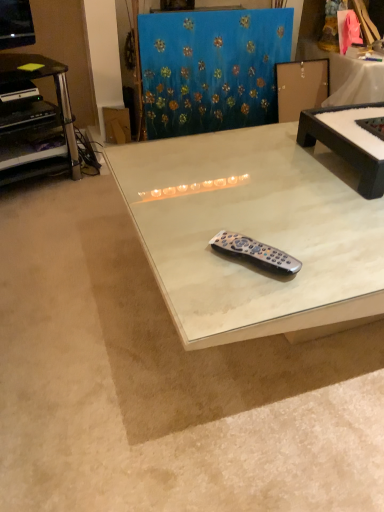
You are a GUI agent. You are given a task and a screenshot of the screen. Output one action in this format:
    pyautogui.click(x=<x>, y=<y>)
    Task: Click on the white marble table at center, the second table from the right
    This screenshot has width=384, height=512.
    Given the screenshot: What is the action you would take?
    pyautogui.click(x=253, y=233)

What do you see at coordinates (116, 125) in the screenshot? I see `cardboard at upper left` at bounding box center [116, 125].

Locate an element on the screen. The width and height of the screenshot is (384, 512). cardboard at upper left is located at coordinates (116, 125).

Measure the distance between point (x=343, y=112) and camera.

Point (x=343, y=112) is 4.36 feet from camera.

The height and width of the screenshot is (512, 384). Identify the location of white marble table at center, the second table from the right. (253, 233).

Is black plastic desk at left oriented towards cardboard at upper left?

No, black plastic desk at left is not turned towards cardboard at upper left.

From a real-world perspective, is black plastic desk at left under cardboard at upper left?

No, from a real-world perspective, black plastic desk at left is not beneath cardboard at upper left.

How many degrees apart are the facing directions of black plastic desk at left and cardboard at upper left?

The angular difference between black plastic desk at left and cardboard at upper left is 23.7 degrees.

Does black plastic desk at left touch cardboard at upper left?

There is a gap between black plastic desk at left and cardboard at upper left.

Between black plastic remote at center and white marble table at center, the second table from the right, which one has less height?

Standing shorter between the two is black plastic remote at center.

In terms of width, does black plastic remote at center look wider or thinner when compared to white marble table at center, the second table from the right?

Considering their sizes, black plastic remote at center looks slimmer than white marble table at center, the second table from the right.

Which is more to the left, black plastic remote at center or white marble table at center, the second table from the right?

black plastic remote at center is more to the left.

Is black plastic remote at center bigger or smaller than blue textured fabric at upper center?

Clearly, black plastic remote at center is smaller in size than blue textured fabric at upper center.

Is black plastic remote at center touching blue textured fabric at upper center?

black plastic remote at center and blue textured fabric at upper center are not in contact.

From a real-world perspective, is black plastic remote at center below blue textured fabric at upper center?

No, from a real-world perspective, black plastic remote at center is not below blue textured fabric at upper center.

Could you tell me if black plastic remote at center is turned towards blue textured fabric at upper center?

No, black plastic remote at center is not aimed at blue textured fabric at upper center.

Is cardboard at upper left bigger than blue textured fabric at upper center?

No.

Which object is positioned more to the right, cardboard at upper left or blue textured fabric at upper center?

Positioned to the right is blue textured fabric at upper center.

Based on the photo, could you tell me if cardboard at upper left is facing blue textured fabric at upper center?

No, cardboard at upper left is not turned towards blue textured fabric at upper center.

Which of these two, cardboard at upper left or blue textured fabric at upper center, is thinner?

With smaller width is blue textured fabric at upper center.

Can you confirm if black matte table at center, the 1th table in the right-to-left sequence, is bigger than blue textured fabric at upper center?

No, black matte table at center, the 1th table in the right-to-left sequence, is not bigger than blue textured fabric at upper center.

Is the surface of black matte table at center, the 1th table in the right-to-left sequence, in direct contact with blue textured fabric at upper center?

No, black matte table at center, the 1th table in the right-to-left sequence, is not making contact with blue textured fabric at upper center.

Does black matte table at center, the 1th table in the right-to-left sequence, come behind blue textured fabric at upper center?

No, black matte table at center, the 1th table in the right-to-left sequence, is in front of blue textured fabric at upper center.

Considering the relative sizes of black matte table at center, the 2th table from the left, and blue textured fabric at upper center in the image provided, is black matte table at center, the 2th table from the left, taller than blue textured fabric at upper center?

Incorrect, the height of black matte table at center, the 2th table from the left, is not larger of that of blue textured fabric at upper center.

From a real-world perspective, relative to black plastic desk at left, is cardboard at upper left vertically above or below?

Clearly, from a real-world perspective, cardboard at upper left is below black plastic desk at left.

Does point (128, 122) come behind point (78, 176)?

Yes, point (128, 122) is farther from viewer.

Is cardboard at upper left in front of or behind black plastic desk at left in the image?

cardboard at upper left is positioned farther from the viewer than black plastic desk at left.

Considering the relative positions of cardboard at upper left and black plastic desk at left in the image provided, is cardboard at upper left to the left of black plastic desk at left from the viewer's perspective?

In fact, cardboard at upper left is to the right of black plastic desk at left.

Is blue textured fabric at upper center with cardboard at upper left?

No, blue textured fabric at upper center is not with cardboard at upper left.

Is blue textured fabric at upper center at the left side of cardboard at upper left?

No.

From a real-world perspective, who is located higher, blue textured fabric at upper center or cardboard at upper left?

blue textured fabric at upper center is physically above.

Is blue textured fabric at upper center outside of cardboard at upper left?

That's correct, blue textured fabric at upper center is outside of cardboard at upper left.

You are a GUI agent. You are given a task and a screenshot of the screen. Output one action in this format:
    pyautogui.click(x=<x>, y=<y>)
    Task: Click on the desk that appears in front of the cardboard at upper left
    The image size is (384, 512).
    Given the screenshot: What is the action you would take?
    pyautogui.click(x=36, y=123)

You are a GUI agent. You are given a task and a screenshot of the screen. Output one action in this format:
    pyautogui.click(x=<x>, y=<y>)
    Task: Click on the table that is the 1st object to the right of the black plastic remote at center, starting at the anchor
    This screenshot has width=384, height=512.
    Given the screenshot: What is the action you would take?
    pyautogui.click(x=253, y=233)

Looking at the image, which one is located closer to blue textured fabric at upper center, white marble table at center, the 1th table positioned from the left, or black plastic desk at left?

black plastic desk at left is closer to blue textured fabric at upper center.

Based on their spatial positions, is black plastic remote at center or white marble table at center, the 1th table positioned from the left, further from blue textured fabric at upper center?

Among the two, black plastic remote at center is located further to blue textured fabric at upper center.

Consider the image. Estimate the real-world distances between objects in this image. Which object is closer to black plastic desk at left, cardboard at upper left or black plastic remote at center?

Among the two, cardboard at upper left is located nearer to black plastic desk at left.

Based on their spatial positions, is white marble table at center, the 1th table positioned from the left, or blue textured fabric at upper center closer to black plastic desk at left?

blue textured fabric at upper center is closer to black plastic desk at left.

Based on their spatial positions, is white marble table at center, the second table from the right, or cardboard at upper left further from black plastic remote at center?

cardboard at upper left.

Estimate the real-world distances between objects in this image. Which object is closer to cardboard at upper left, black plastic remote at center or black plastic desk at left?

The object closer to cardboard at upper left is black plastic desk at left.

Looking at the image, which one is located closer to black plastic desk at left, black matte table at center, the 2th table from the left, or blue textured fabric at upper center?

Based on the image, blue textured fabric at upper center appears to be nearer to black plastic desk at left.

Consider the image. Estimate the real-world distances between objects in this image. Which object is further from black plastic desk at left, white marble table at center, the 1th table positioned from the left, or black plastic remote at center?

Among the two, black plastic remote at center is located further to black plastic desk at left.

The height and width of the screenshot is (512, 384). What are the coordinates of `desk between black plastic remote at center and cardboard at upper left from front to back` in the screenshot? It's located at (36, 123).

Where is `table positioned between white marble table at center, the second table from the right, and blue textured fabric at upper center from near to far`? The width and height of the screenshot is (384, 512). table positioned between white marble table at center, the second table from the right, and blue textured fabric at upper center from near to far is located at coordinates (346, 144).

Locate an element on the screen. The height and width of the screenshot is (512, 384). curtain between black matte table at center, the 2th table from the left, and cardboard at upper left, along the z-axis is located at coordinates (211, 68).

Where is `curtain between black plastic desk at left and white marble table at center, the second table from the right`? The height and width of the screenshot is (512, 384). curtain between black plastic desk at left and white marble table at center, the second table from the right is located at coordinates (211, 68).